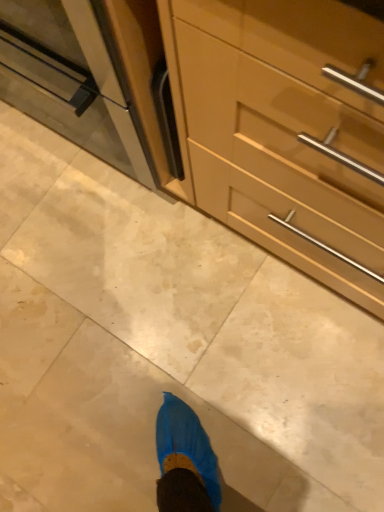
The height and width of the screenshot is (512, 384). What do you see at coordinates (281, 131) in the screenshot? I see `matte wood cabinet at center` at bounding box center [281, 131].

The height and width of the screenshot is (512, 384). I want to click on matte wood cabinet at center, so click(x=281, y=131).

The image size is (384, 512). Identify the location of matte wood cabinet at center. (281, 131).